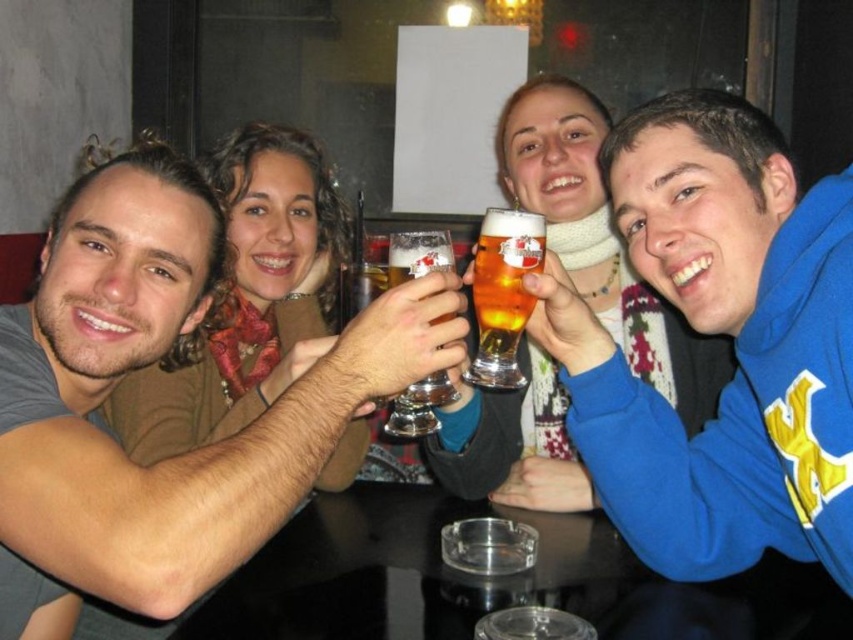
You are standing at the entrance of the bar and want to find the blue fleece sweatshirt at upper right. Based on the coordinates provided in the description, can you estimate its position relative to the center of the image?

The blue fleece sweatshirt at upper right is located at point 0.522 on the x axis and 0.845 on the y axis, which means it is slightly to the right and higher up than the center of the image.

You are standing at the point labeled point (448, 234) and want to walk to the point labeled point (492, 353). Which direction should you face to move towards your destination?

You should face towards the back direction because point (492, 353) is behind point (448, 234).

What is the relationship between the width of the blue fleece sweatshirt at upper right and the transparent glass ashtray at center?

The blue fleece sweatshirt at upper right is narrower than the transparent glass ashtray at center.